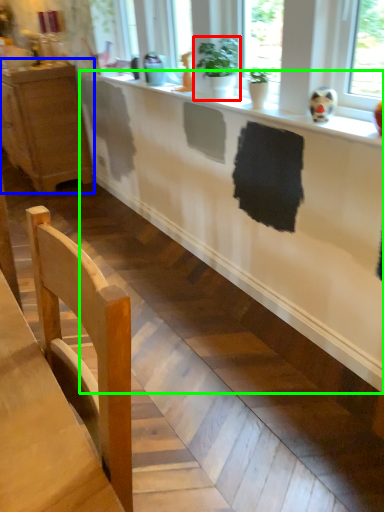
Question: Which object is the closest to the houseplant (highlighted by a red box)? Choose among these: cabinetry (highlighted by a blue box) or counter (highlighted by a green box).

Choices:
 (A) cabinetry
 (B) counter

Answer: (B)